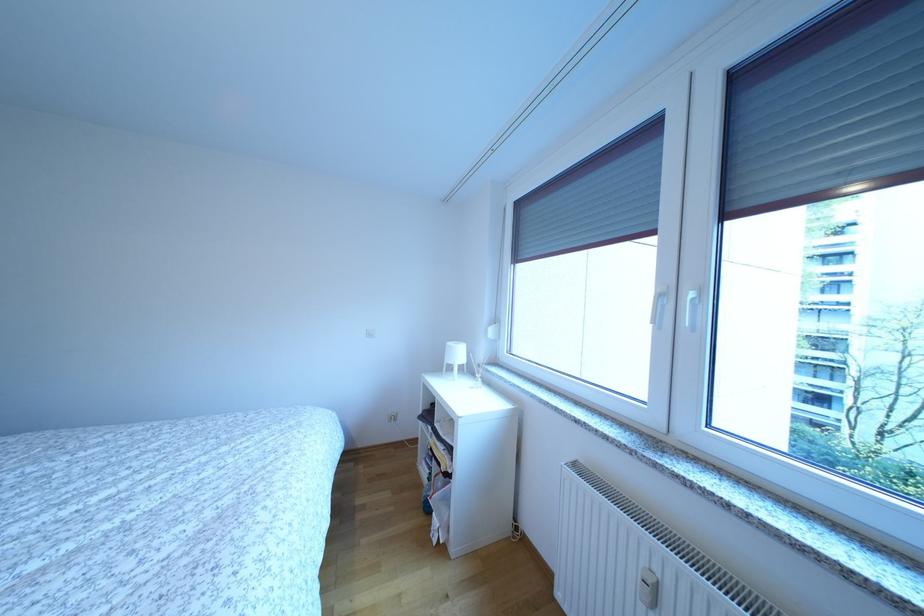
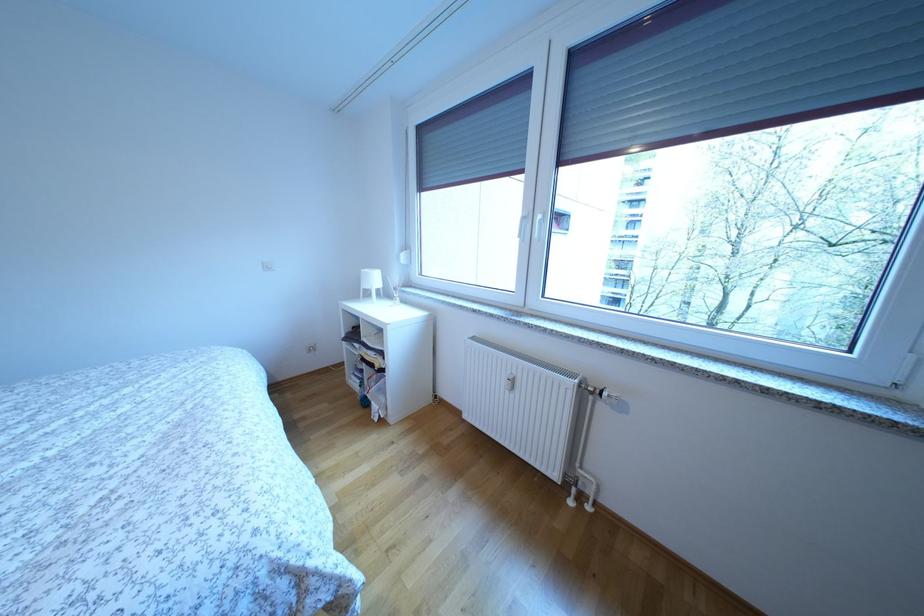
In the second image, find the point that corresponds to point (466, 360) in the first image.

(382, 285)